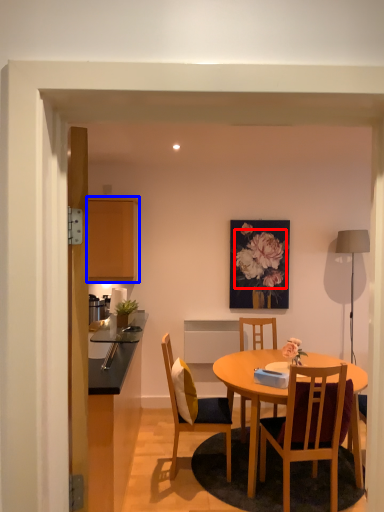
Question: Which object is closer to the camera taking this photo, flower (highlighted by a red box) or cabinetry (highlighted by a blue box)?

Choices:
 (A) flower
 (B) cabinetry

Answer: (B)